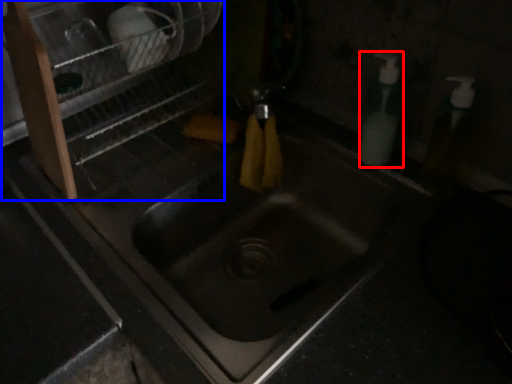
Question: Among these objects, which one is farthest to the camera, soap dispenser (highlighted by a red box) or dish washer (highlighted by a blue box)?

Choices:
 (A) soap dispenser
 (B) dish washer

Answer: (A)